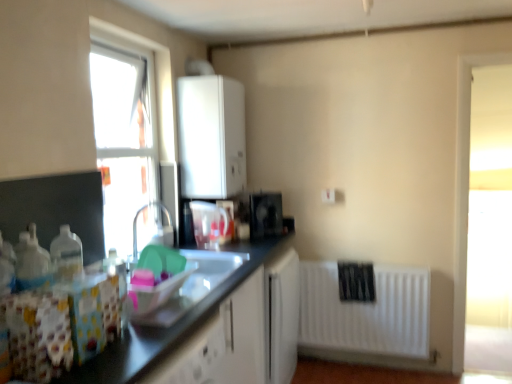
Identify the location of black plastic toaster at upper center, the 2th appliance viewed from the left. (265, 214).

The width and height of the screenshot is (512, 384). I want to click on transparent glass window at upper left, so click(127, 129).

Image resolution: width=512 pixels, height=384 pixels. I want to click on white matte radiator at lower right, so click(x=366, y=312).

The width and height of the screenshot is (512, 384). Describe the element at coordinates (210, 224) in the screenshot. I see `translucent plastic container at center, which appears as the 2th appliance when viewed from the right` at that location.

The width and height of the screenshot is (512, 384). In order to click on white matte boiler at upper center in this screenshot , I will do `click(211, 136)`.

Considering the sizes of objects black plastic toaster at upper center, the 2th appliance from the front, and transparent glass window at upper left in the image provided, who is wider, black plastic toaster at upper center, the 2th appliance from the front, or transparent glass window at upper left?

transparent glass window at upper left is wider.

Between point (262, 200) and point (126, 229), which one is positioned behind?

The point (262, 200) is farther from the camera.

From the image's perspective, which is above, black plastic toaster at upper center, the 1th appliance from the right, or transparent glass window at upper left?

From the image's view, transparent glass window at upper left is above.

How much distance is there between black plastic toaster at upper center, the 2th appliance viewed from the left, and transparent glass window at upper left?

black plastic toaster at upper center, the 2th appliance viewed from the left, is 37.64 inches away from transparent glass window at upper left.

Considering the positions of point (197, 211) and point (254, 199), is point (197, 211) closer or farther from the camera than point (254, 199)?

Point (197, 211) is positioned closer to the camera compared to point (254, 199).

In order to click on appliance above the black plastic toaster at upper center, the 2th appliance viewed from the left (from a real-world perspective) in this screenshot , I will do `click(210, 224)`.

Consider the image. Considering the relative sizes of translucent plastic container at center, which ranks as the 1th appliance in left-to-right order, and black plastic toaster at upper center, which is the first appliance from back to front, in the image provided, is translucent plastic container at center, which ranks as the 1th appliance in left-to-right order, taller than black plastic toaster at upper center, which is the first appliance from back to front,?

Indeed, translucent plastic container at center, which ranks as the 1th appliance in left-to-right order, has a greater height compared to black plastic toaster at upper center, which is the first appliance from back to front.

Considering the relative positions of translucent plastic container at center, the first appliance when ordered from front to back, and black plastic toaster at upper center, which is the first appliance from back to front, in the image provided, is translucent plastic container at center, the first appliance when ordered from front to back, behind black plastic toaster at upper center, which is the first appliance from back to front,?

No, translucent plastic container at center, the first appliance when ordered from front to back, is closer to the viewer.

Would you say shiny plastic containers at lower left is outside white matte boiler at upper center?

Yes.

Which of these two, shiny plastic containers at lower left or white matte boiler at upper center, stands shorter?

Standing shorter between the two is shiny plastic containers at lower left.

Between shiny plastic containers at lower left and white matte boiler at upper center, which one is positioned in front?

Positioned in front is shiny plastic containers at lower left.

Is shiny plastic containers at lower left at the left side of white matte boiler at upper center?

Yes, shiny plastic containers at lower left is to the left of white matte boiler at upper center.

Can black plastic toaster at upper center, the 1th appliance from the right, be found inside white matte radiator at lower right?

No, black plastic toaster at upper center, the 1th appliance from the right, is not a part of white matte radiator at lower right.

From a real-world perspective, is white matte radiator at lower right physically located above or below black plastic toaster at upper center, which is the first appliance from back to front?

white matte radiator at lower right is below black plastic toaster at upper center, which is the first appliance from back to front.

Is point (327, 287) farther from viewer compared to point (271, 197)?

No.

Which is behind, white matte radiator at lower right or white matte boiler at upper center?

white matte radiator at lower right is behind.

Is white matte radiator at lower right taller or shorter than white matte boiler at upper center?

white matte radiator at lower right is shorter than white matte boiler at upper center.

Which of these two, white matte radiator at lower right or white matte boiler at upper center, is bigger?

white matte boiler at upper center is bigger.

Is white matte radiator at lower right oriented away from white matte boiler at upper center?

white matte radiator at lower right is not turned away from white matte boiler at upper center.

Would you say white matte boiler at upper center is inside or outside white matte radiator at lower right?

white matte boiler at upper center exists outside the volume of white matte radiator at lower right.

Considering the sizes of objects white matte boiler at upper center and white matte radiator at lower right in the image provided, who is wider, white matte boiler at upper center or white matte radiator at lower right?

white matte boiler at upper center is wider.

Which is closer, [184,176] or [320,344]?

Point [184,176].

How much distance is there between white matte boiler at upper center and white matte radiator at lower right?

white matte boiler at upper center and white matte radiator at lower right are 3.77 feet apart from each other.

Does point (173, 209) appear closer or farther from the camera than point (157, 203)?

Point (173, 209).

Is transparent glass window at upper left outside of green plastic faucet at center?

Absolutely, transparent glass window at upper left is external to green plastic faucet at center.

Is transparent glass window at upper left positioned in front of green plastic faucet at center?

No.

From a real-world perspective, between transparent glass window at upper left and green plastic faucet at center, who is vertically lower?

From a 3D spatial view, green plastic faucet at center is below.

Identify the location of the 2nd appliance counting from the right side of the transparent glass window at upper left. point(265,214).

This screenshot has height=384, width=512. In order to click on appliance that is below the black plastic toaster at upper center, the 1th appliance from the right (from the image's perspective) in this screenshot , I will do `click(210, 224)`.

Considering their positions, is black plastic toaster at upper center, the 2th appliance from the front, positioned further to transparent glass window at upper left than white matte radiator at lower right?

white matte radiator at lower right is further to transparent glass window at upper left.

Considering their positions, is shiny plastic containers at lower left positioned closer to white matte radiator at lower right than black plastic toaster at upper center, the 1th appliance from the right?

Based on the image, black plastic toaster at upper center, the 1th appliance from the right, appears to be nearer to white matte radiator at lower right.

Looking at the image, which one is located closer to shiny plastic containers at lower left, translucent plastic container at center, which appears as the 2th appliance when viewed from the right, or white matte boiler at upper center?

Among the two, translucent plastic container at center, which appears as the 2th appliance when viewed from the right, is located nearer to shiny plastic containers at lower left.

Looking at the image, which one is located closer to green plastic faucet at center, transparent glass window at upper left or shiny plastic containers at lower left?

transparent glass window at upper left.

Based on their spatial positions, is green plastic faucet at center or transparent glass window at upper left further from shiny plastic containers at lower left?

transparent glass window at upper left is further to shiny plastic containers at lower left.

Estimate the real-world distances between objects in this image. Which object is closer to translucent plastic container at center, the first appliance when ordered from front to back, white matte radiator at lower right or black plastic toaster at upper center, which is the first appliance from back to front?

Based on the image, black plastic toaster at upper center, which is the first appliance from back to front, appears to be nearer to translucent plastic container at center, the first appliance when ordered from front to back.

From the image, which object appears to be farther from white matte boiler at upper center, white matte radiator at lower right or green plastic faucet at center?

The object further to white matte boiler at upper center is white matte radiator at lower right.

Considering their positions, is white matte boiler at upper center positioned closer to transparent glass window at upper left than translucent plastic container at center, which ranks as the 1th appliance in left-to-right order?

Based on the image, white matte boiler at upper center appears to be nearer to transparent glass window at upper left.

Find the location of a particular element. faucet between shiny plastic containers at lower left and black plastic toaster at upper center, the 1th appliance from the right, in the front-back direction is located at coordinates (136, 225).

Where is `faucet between transparent glass window at upper left and shiny plastic containers at lower left in the vertical direction`? The width and height of the screenshot is (512, 384). faucet between transparent glass window at upper left and shiny plastic containers at lower left in the vertical direction is located at coordinates (136, 225).

You are a GUI agent. You are given a task and a screenshot of the screen. Output one action in this format:
    pyautogui.click(x=<x>, y=<y>)
    Task: Click on the radiator located between shiny plastic containers at lower left and black plastic toaster at upper center, the 2th appliance from the front, in the depth direction
    The image size is (512, 384).
    Given the screenshot: What is the action you would take?
    pyautogui.click(x=366, y=312)

Locate an element on the screen. window located between green plastic faucet at center and black plastic toaster at upper center, the 2th appliance viewed from the left, in the depth direction is located at coordinates (127, 129).